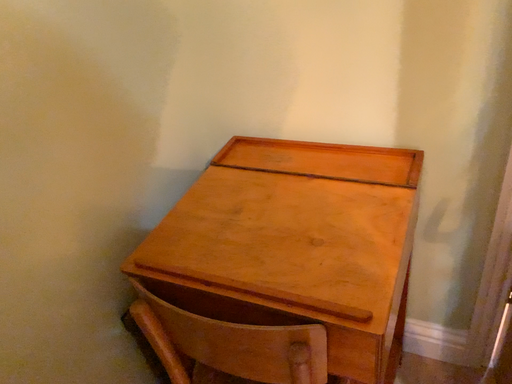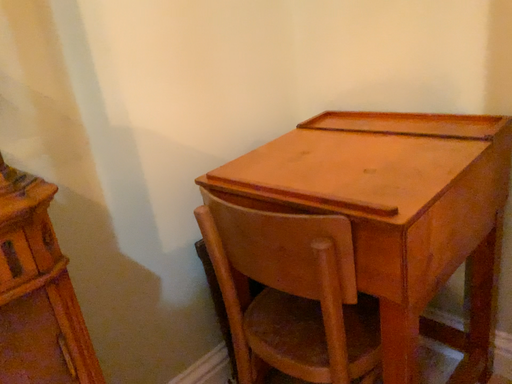
Question: How did the camera likely rotate when shooting the video?

Choices:
 (A) rotated right
 (B) rotated left

Answer: (B)